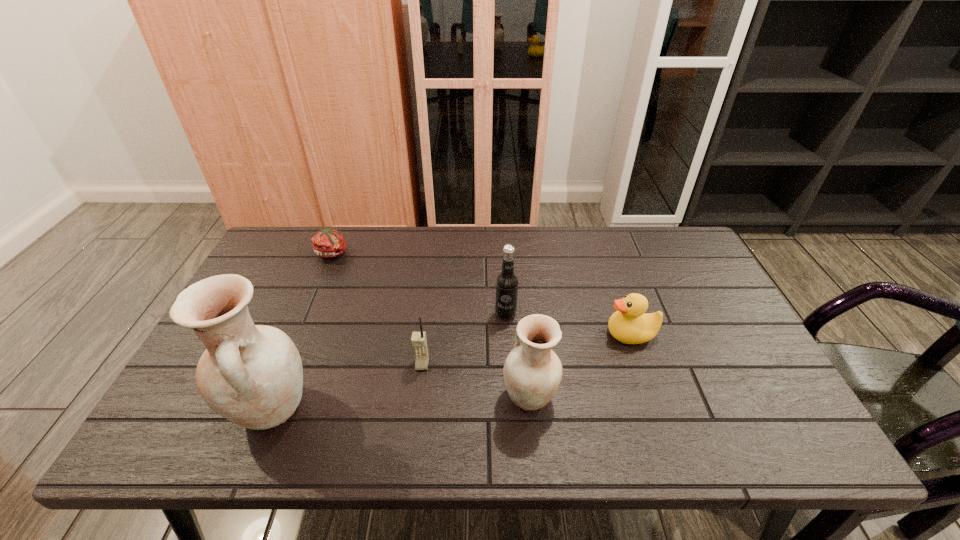
The width and height of the screenshot is (960, 540). I want to click on the taller pottery, so click(252, 375).

Find the location of a particular element. The height and width of the screenshot is (540, 960). the left pottery is located at coordinates (252, 375).

Image resolution: width=960 pixels, height=540 pixels. Find the location of `the shorter pottery`. the shorter pottery is located at coordinates (532, 372).

Where is `the farthest object`? This screenshot has width=960, height=540. the farthest object is located at coordinates (327, 243).

The height and width of the screenshot is (540, 960). What are the coordinates of `the shortest object` in the screenshot? It's located at (327, 243).

Locate an element on the screen. The image size is (960, 540). duck is located at coordinates (630, 324).

Identify the location of the rightmost object. The width and height of the screenshot is (960, 540). [x=630, y=324].

Identify the location of the third nearest object. Image resolution: width=960 pixels, height=540 pixels. (419, 342).

Find the location of a particular element. The width and height of the screenshot is (960, 540). cellular telephone is located at coordinates (419, 342).

At what (x,y) coordinates should I click in order to perform the action: click on root beer. Please return your answer as a coordinate pair (x, y). This screenshot has height=540, width=960. Looking at the image, I should click on (507, 282).